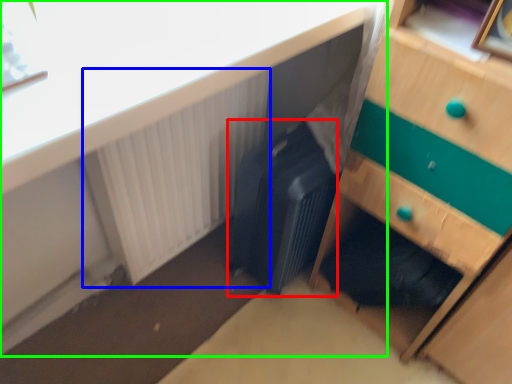
Question: Which is farther away from luggage (highlighted by a red box)? radiator (highlighted by a blue box) or desk (highlighted by a green box)?

Choices:
 (A) radiator
 (B) desk

Answer: (B)